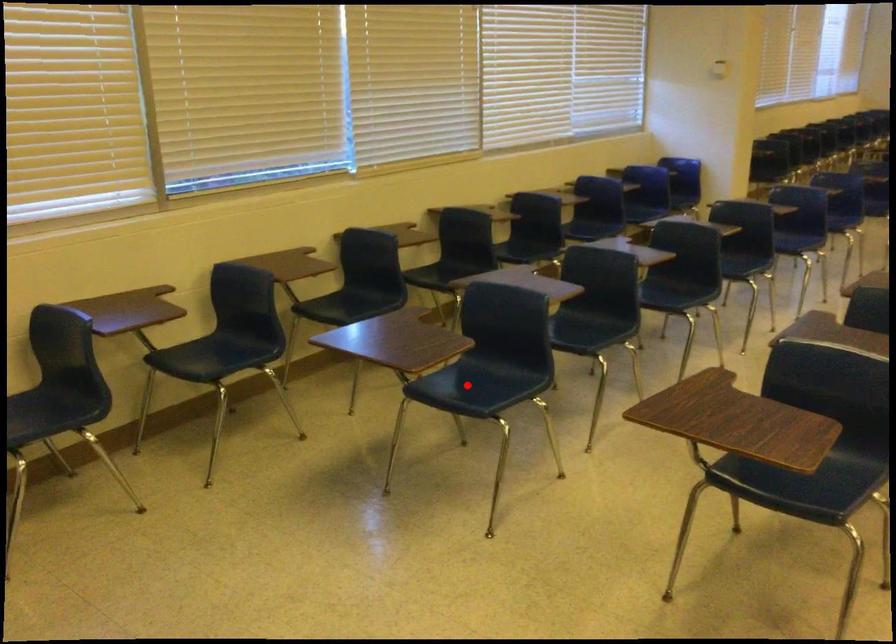
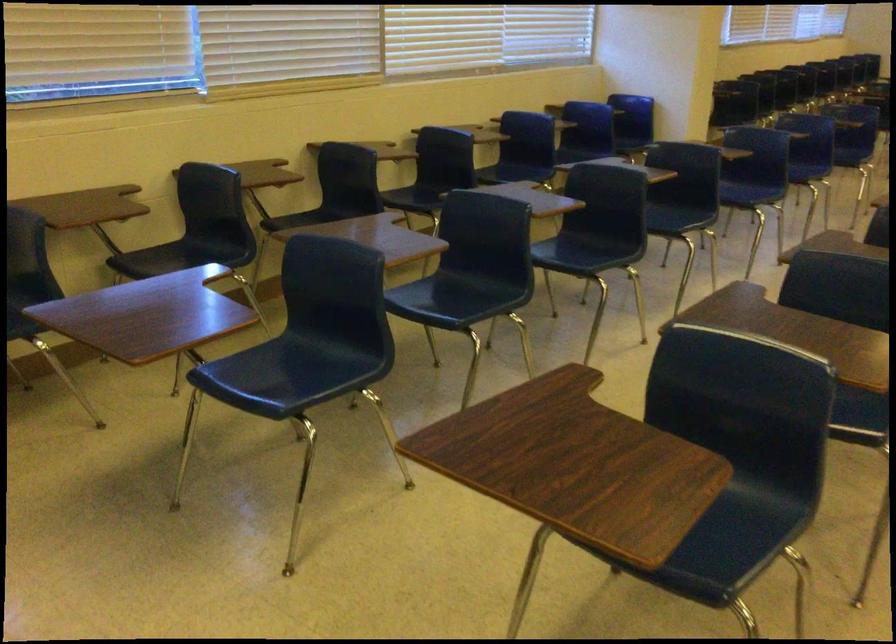
Find the pixel in the second image that matches the highlighted location in the first image.

(283, 375)